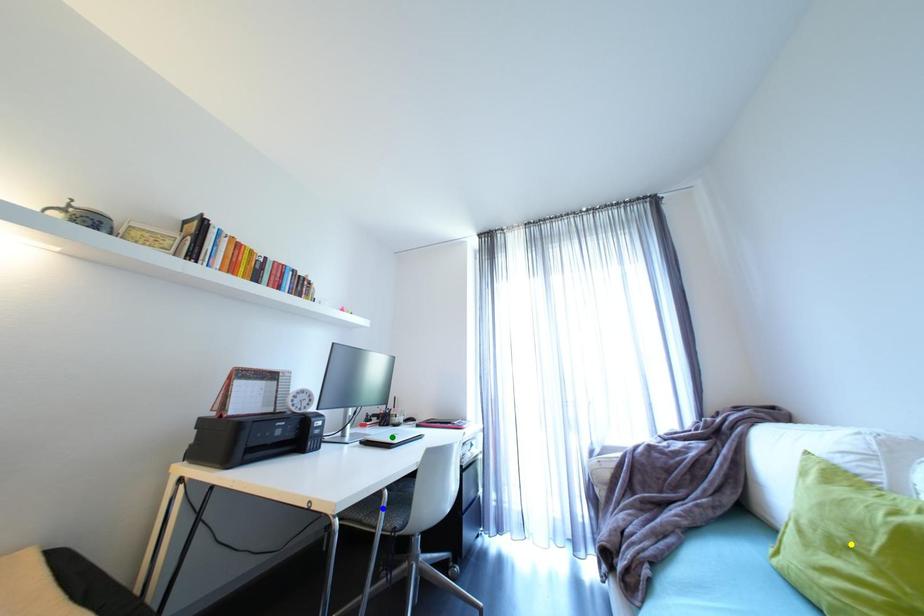
Order these from nearest to farthest:
yellow point, green point, blue point

yellow point < blue point < green point